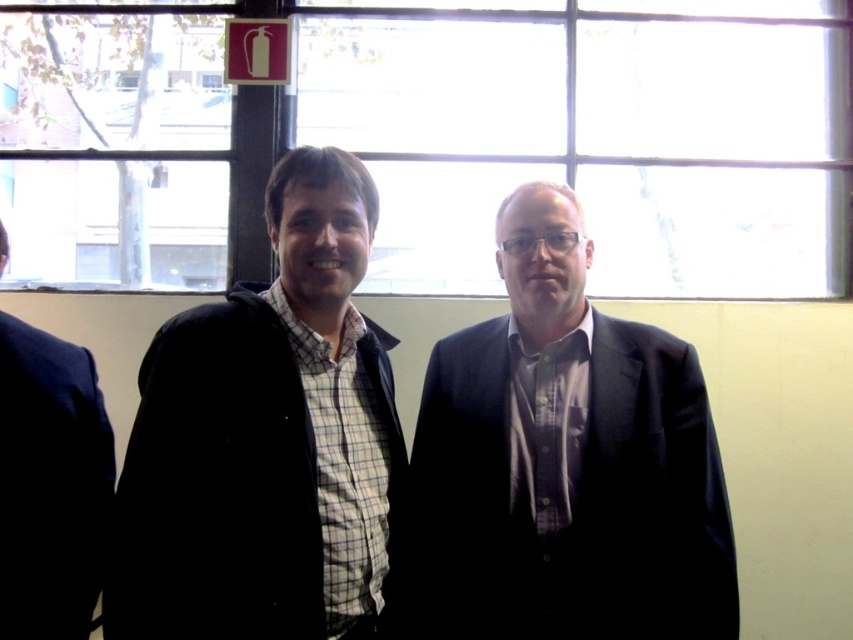
Is point (479, 531) positioned after point (242, 369)?

Yes, it is behind point (242, 369).

In order to click on dark gray suit at center in this screenshot , I will do `click(566, 461)`.

Is point (251, 634) behind point (90, 465)?

No, (251, 634) is in front of (90, 465).

Is point (299, 196) farther from camera compared to point (100, 403)?

No.

At what (x,y) coordinates should I click in order to perform the action: click on matte black jacket at center. Please return your answer as a coordinate pair (x, y). Image resolution: width=853 pixels, height=640 pixels. Looking at the image, I should click on (265, 440).

Can you confirm if clear glass window at upper center is positioned to the right of dark gray suit at center?

No, clear glass window at upper center is not to the right of dark gray suit at center.

Is clear glass window at upper center bigger than dark gray suit at center?

Yes.

This screenshot has width=853, height=640. Find the location of `clear glass window at upper center`. clear glass window at upper center is located at coordinates (442, 138).